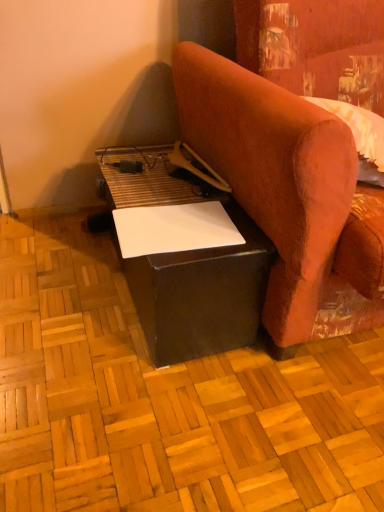
This screenshot has width=384, height=512. What are the coordinates of `vacant point to the left of black matte table at lower center` in the screenshot? It's located at (57, 278).